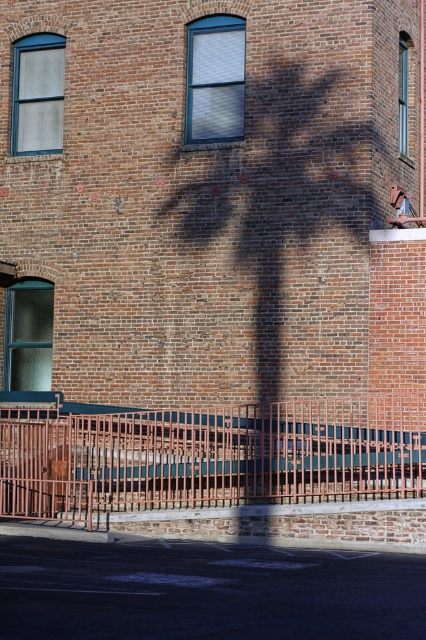
In the scene shown: Between brown textured tree at center and rusty metal fence at lower center, which one has more height?

brown textured tree at center

Can you confirm if brown textured tree at center is positioned to the left of rusty metal fence at lower center?

No, brown textured tree at center is not to the left of rusty metal fence at lower center.

Measure the distance between point (161, 292) and camera.

A distance of 70.09 feet exists between point (161, 292) and camera.

At what (x,y) coordinates should I click in order to perform the action: click on brown textured tree at center. Please return your answer as a coordinate pair (x, y). Looking at the image, I should click on (265, 244).